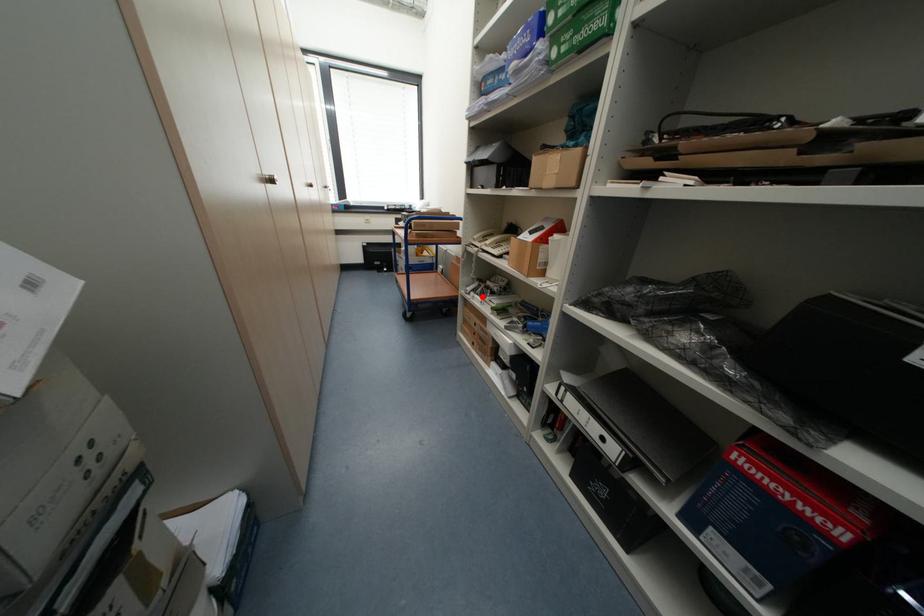
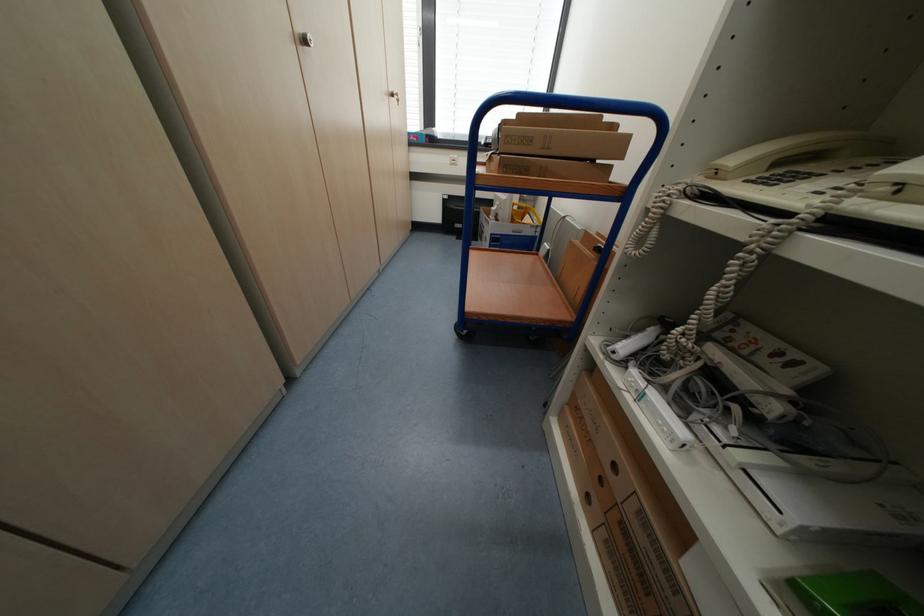
Question: I am providing you with two images of the same scene from different viewpoints. A red point is marked on the first image. Is the red point's position out of view in image 2?

Choices:
 (A) Yes
 (B) No

Answer: (B)